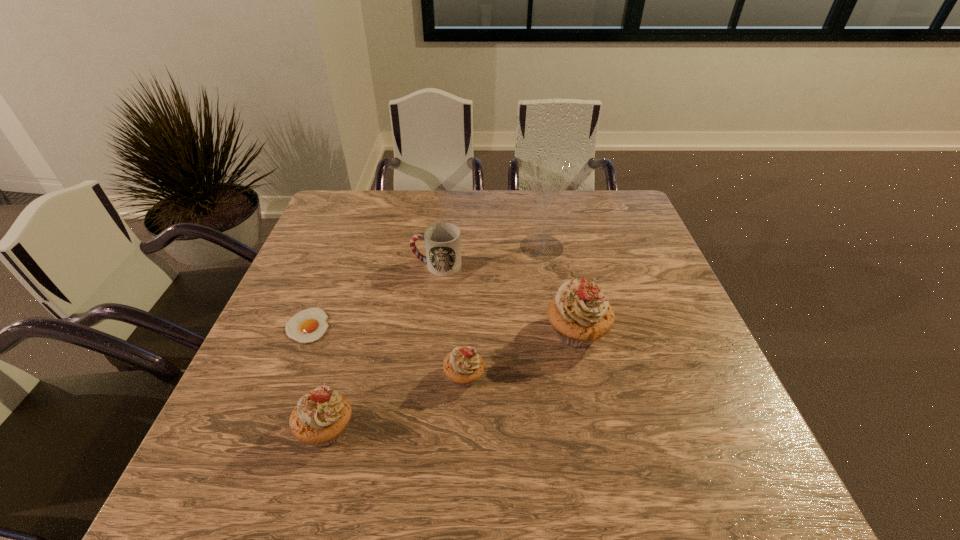
At what (x,y) coordinates should I click in order to perform the action: click on egg yolk that is at the left edge. Please return your answer as a coordinate pair (x, y). This screenshot has width=960, height=540. Looking at the image, I should click on (309, 325).

The image size is (960, 540). Find the location of `object located in the near left corner section of the desktop`. object located in the near left corner section of the desktop is located at coordinates (320, 417).

In the image, there is a desktop. Where is `vacant area at the far edge`? The image size is (960, 540). vacant area at the far edge is located at coordinates (396, 213).

In the image, there is a desktop. Where is `vacant space at the left edge`? This screenshot has height=540, width=960. vacant space at the left edge is located at coordinates (296, 307).

Identify the location of vacant area at the right edge. (662, 320).

Locate an element on the screen. This screenshot has height=540, width=960. vacant space at the far left corner of the desktop is located at coordinates (344, 217).

I want to click on vacant region at the near left corner of the desktop, so click(x=220, y=433).

Find the location of a particular element. The height and width of the screenshot is (540, 960). free space at the far right corner of the desktop is located at coordinates (598, 198).

This screenshot has height=540, width=960. In order to click on free space between the second cupcake from left to right and the leftmost object in this screenshot , I will do `click(386, 351)`.

Where is `free spot between the second farthest cupcake and the cup`? The width and height of the screenshot is (960, 540). free spot between the second farthest cupcake and the cup is located at coordinates (450, 321).